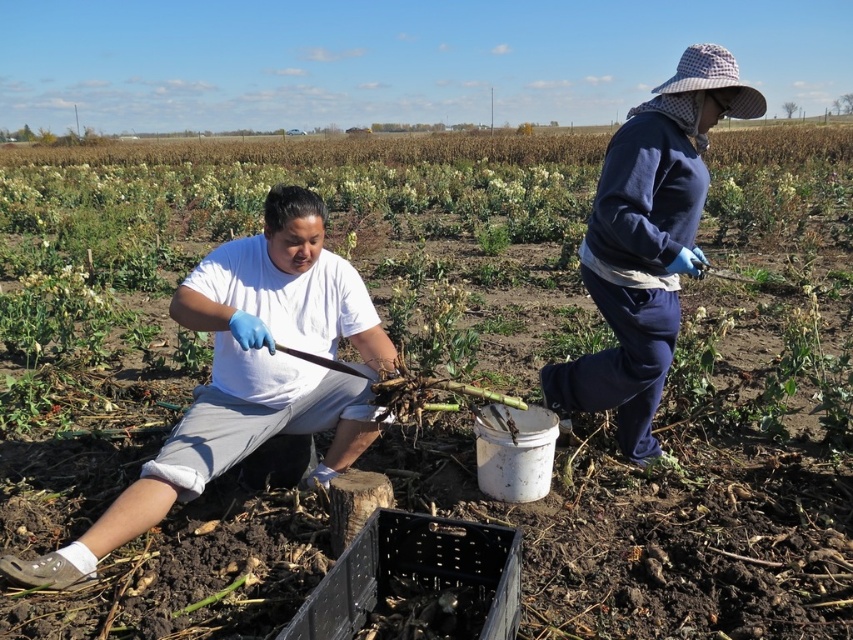
Question: Among these objects, which one is nearest to the camera?

Choices:
 (A) white cotton shirt at center
 (B) navy fleece jacket at upper right

Answer: (A)

Question: Is white cotton shirt at center above navy fleece jacket at upper right?

Choices:
 (A) yes
 (B) no

Answer: (B)

Question: Which point is closer to the camera?

Choices:
 (A) navy fleece jacket at upper right
 (B) white cotton shirt at center

Answer: (B)

Question: Considering the relative positions of white cotton shirt at center and navy fleece jacket at upper right in the image provided, where is white cotton shirt at center located with respect to navy fleece jacket at upper right?

Choices:
 (A) above
 (B) below

Answer: (B)

Question: Which of the following is the farthest from the observer?

Choices:
 (A) navy fleece jacket at upper right
 (B) white cotton shirt at center

Answer: (A)

Question: Does white cotton shirt at center appear on the left side of navy fleece jacket at upper right?

Choices:
 (A) yes
 (B) no

Answer: (A)